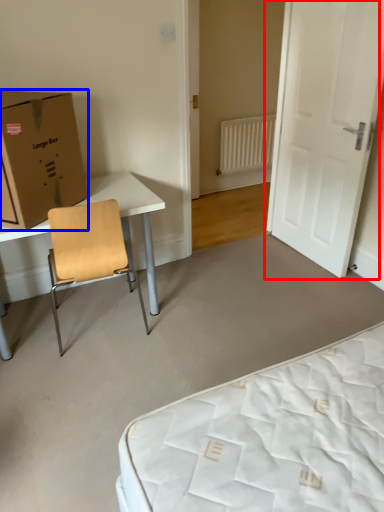
Question: Which object appears farthest to the camera in this image, door (highlighted by a red box) or box (highlighted by a blue box)?

Choices:
 (A) door
 (B) box

Answer: (A)